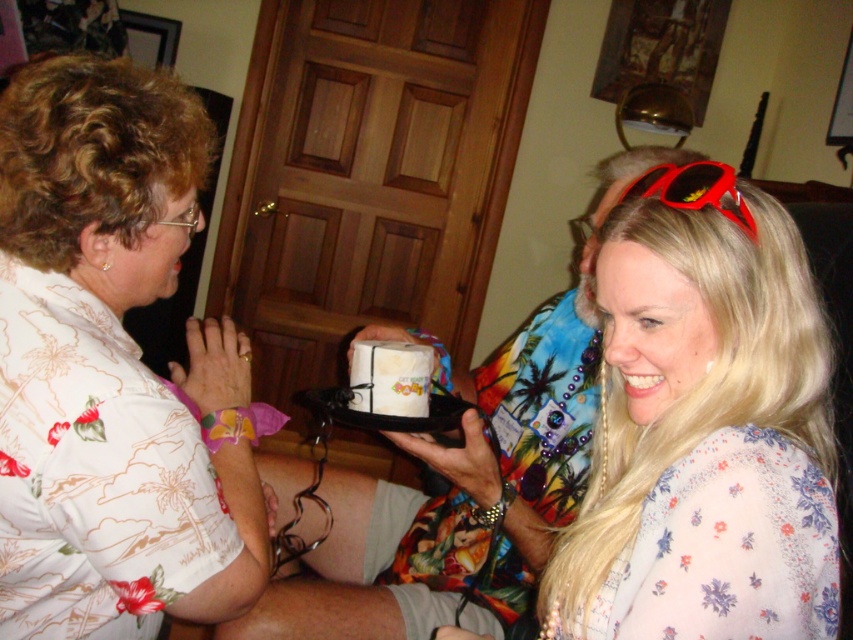
Question: Estimate the real-world distances between objects in this image. Which object is closer to the red plastic sunglasses at upper right?

Choices:
 (A) floral sheer blouse at center
 (B) white paper cake at center

Answer: (A)

Question: Which object is the closest to the floral sheer blouse at center?

Choices:
 (A) red plastic sunglasses at upper right
 (B) white paper cake at center

Answer: (A)

Question: Is white paper cake at center positioned before red plastic sunglasses at upper right?

Choices:
 (A) yes
 (B) no

Answer: (B)

Question: Is white floral shirt at upper left in front of red plastic sunglasses at upper right?

Choices:
 (A) no
 (B) yes

Answer: (A)

Question: Which point is closer to the camera?

Choices:
 (A) (380, 376)
 (B) (613, 570)

Answer: (B)

Question: Can you confirm if white floral shirt at upper left is thinner than white paper cake at center?

Choices:
 (A) yes
 (B) no

Answer: (B)